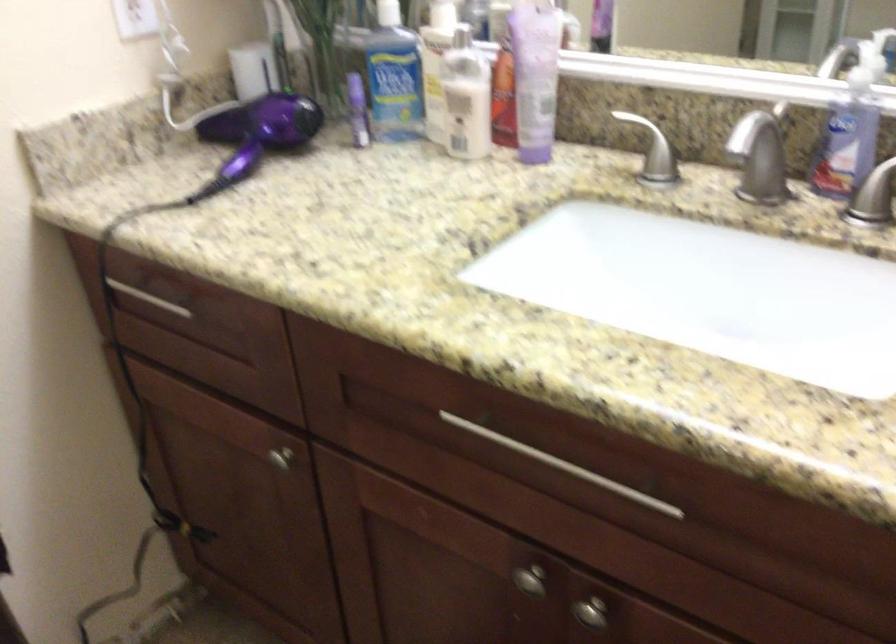
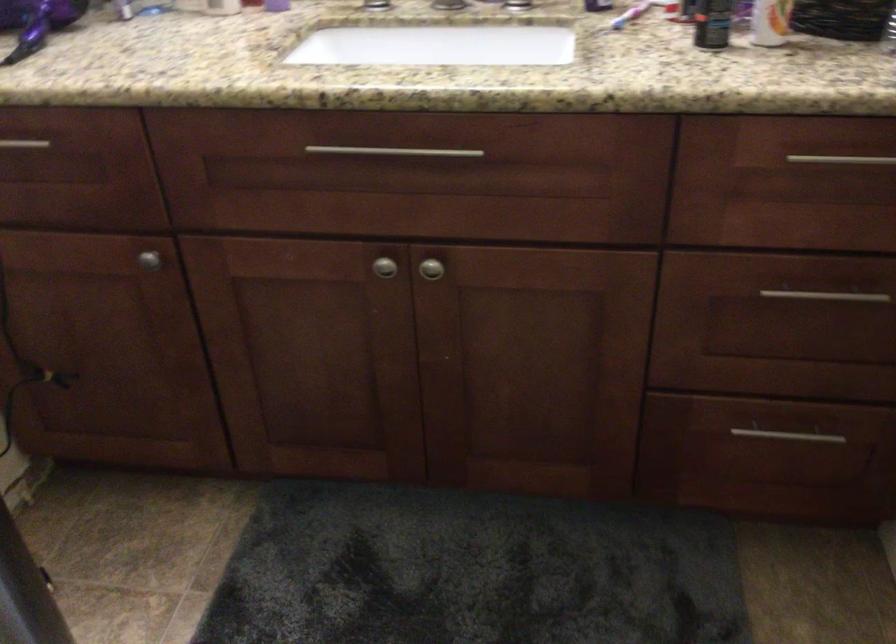
The point at (x=554, y=451) is marked in the first image. Where is the corresponding point in the second image?

(394, 152)